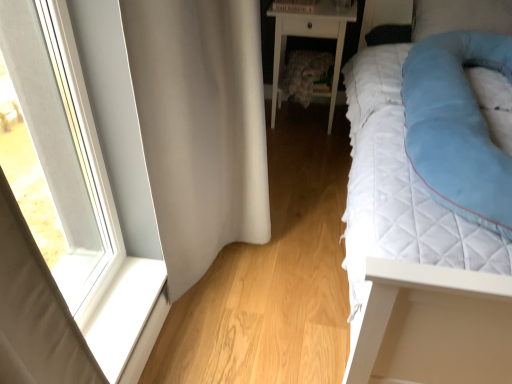
Question: From their relative heights in the image, would you say light blue quilted pillow at right is taller or shorter than white smooth window sill at lower left?

Choices:
 (A) short
 (B) tall

Answer: (B)

Question: Is light blue quilted pillow at right wider or thinner than white smooth window sill at lower left?

Choices:
 (A) wide
 (B) thin

Answer: (A)

Question: Estimate the real-world distances between objects in this image. Which object is closer to the white smooth window sill at lower left?

Choices:
 (A) light blue quilted pillow at right
 (B) white quilted bed at right
 (C) white fabric curtain at left
 (D) white glossy nightstand at center
 (E) blue soft pillow at upper right

Answer: (C)

Question: Which object is the closest to the white smooth window sill at lower left?

Choices:
 (A) white fabric curtain at left
 (B) light blue quilted pillow at right
 (C) white glossy nightstand at center
 (D) blue soft pillow at upper right
 (E) white quilted bed at right

Answer: (A)